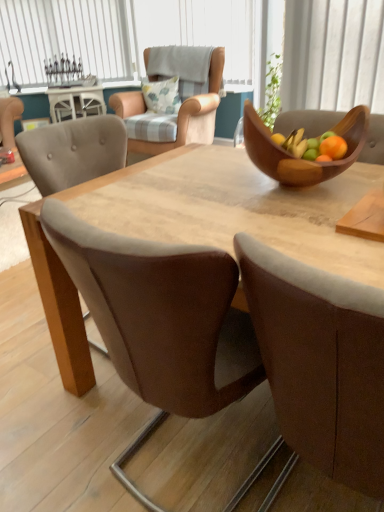
The height and width of the screenshot is (512, 384). Identify the location of light brown wooden table at center. (233, 208).

This screenshot has width=384, height=512. I want to click on white glossy cabinet at upper left, so click(x=75, y=102).

This screenshot has width=384, height=512. In order to click on light brown fabric armchair at upper center, which is the 2th chair in bottom-to-top order in this screenshot , I will do `click(192, 115)`.

What is the approximate width of light brown fabric armchair at upper center, which is the 2th chair in bottom-to-top order?

light brown fabric armchair at upper center, which is the 2th chair in bottom-to-top order, is 35.72 inches in width.

You are a GUI agent. You are given a task and a screenshot of the screen. Output one action in this format:
    pyautogui.click(x=<x>, y=<y>)
    Task: Click on the white vertical blinds at upper left
    
    Given the screenshot: What is the action you would take?
    pyautogui.click(x=66, y=37)

This screenshot has height=512, width=384. What do you see at coordinates (302, 159) in the screenshot? I see `wooden bowl at center` at bounding box center [302, 159].

Describe the element at coordinates (321, 362) in the screenshot. I see `brown leather chair at center, the second chair positioned from the back` at that location.

Where is `light brown wooden table at center`? The width and height of the screenshot is (384, 512). light brown wooden table at center is located at coordinates coord(233,208).

From the image's perspective, is white vertical blinds at upper left under white glossy cabinet at upper left?

Actually, white vertical blinds at upper left appears above white glossy cabinet at upper left in the image.

Is white vertical blinds at upper left facing away from white glossy cabinet at upper left?

No, white vertical blinds at upper left's orientation is not away from white glossy cabinet at upper left.

Does point (85, 46) come in front of point (63, 116)?

No.

In the scene shown: Is white vertical blinds at upper left in front of or behind white glossy cabinet at upper left in the image?

In the image, white vertical blinds at upper left appears behind white glossy cabinet at upper left.

Is light brown fabric armchair at upper center, which appears as the first chair when viewed from the top, looking in the opposite direction of white glossy cabinet at upper left?

No, white glossy cabinet at upper left is not at the back of light brown fabric armchair at upper center, which appears as the first chair when viewed from the top.

Based on the photo, from the image's perspective, is light brown fabric armchair at upper center, which appears as the first chair when viewed from the top, over white glossy cabinet at upper left?

No, from the image's perspective, light brown fabric armchair at upper center, which appears as the first chair when viewed from the top, is not over white glossy cabinet at upper left.

Considering the relative positions of light brown fabric armchair at upper center, which ranks as the 1th chair in back-to-front order, and white glossy cabinet at upper left in the image provided, is light brown fabric armchair at upper center, which ranks as the 1th chair in back-to-front order, to the left of white glossy cabinet at upper left from the viewer's perspective?

In fact, light brown fabric armchair at upper center, which ranks as the 1th chair in back-to-front order, is to the right of white glossy cabinet at upper left.

Where is `the 1st chair in front of the white glossy cabinet at upper left`? The image size is (384, 512). the 1st chair in front of the white glossy cabinet at upper left is located at coordinates (192, 115).

From the picture: Measure the distance between wooden bowl at center and white glossy cabinet at upper left.

They are 3.51 meters apart.

This screenshot has width=384, height=512. What are the coordinates of `coffee table that appears below the wooden bowl at center (from a real-world perspective)` in the screenshot? It's located at (75, 102).

Considering the points (250, 111) and (74, 93), which point is in front, point (250, 111) or point (74, 93)?

Point (250, 111)

Is wooden bowl at center outside of white glossy cabinet at upper left?

wooden bowl at center is positioned outside white glossy cabinet at upper left.

Is wooden bowl at center surrounding light brown fabric armchair at upper center, which appears as the first chair when viewed from the top?

No, light brown fabric armchair at upper center, which appears as the first chair when viewed from the top, is located outside of wooden bowl at center.

Could you tell me if wooden bowl at center is turned towards light brown fabric armchair at upper center, which ranks as the 1th chair in back-to-front order?

No, wooden bowl at center is not turned towards light brown fabric armchair at upper center, which ranks as the 1th chair in back-to-front order.

From a real-world perspective, is wooden bowl at center under light brown fabric armchair at upper center, which ranks as the 1th chair in back-to-front order?

No, from a real-world perspective, wooden bowl at center is not beneath light brown fabric armchair at upper center, which ranks as the 1th chair in back-to-front order.

The height and width of the screenshot is (512, 384). Find the location of `the 1st chair positioned below the wooden bowl at center (from a real-world perspective)`. the 1st chair positioned below the wooden bowl at center (from a real-world perspective) is located at coordinates (192, 115).

Does brown leather chair at center, the second chair positioned from the back, have a greater height compared to fluffy white pillow at upper center?

Yes.

From the image's perspective, which one is positioned lower, brown leather chair at center, the second chair positioned from the back, or fluffy white pillow at upper center?

brown leather chair at center, the second chair positioned from the back, is shown below in the image.

Considering the sizes of brown leather chair at center, which is the 2th chair from top to bottom, and fluffy white pillow at upper center in the image, is brown leather chair at center, which is the 2th chair from top to bottom, bigger or smaller than fluffy white pillow at upper center?

In the image, brown leather chair at center, which is the 2th chair from top to bottom, appears to be larger than fluffy white pillow at upper center.

From the image's perspective, between brown leather chair at center, which ranks as the 1th chair in bottom-to-top order, and light brown wooden table at center, who is located below?

brown leather chair at center, which ranks as the 1th chair in bottom-to-top order, appears lower in the image.

Is point (326, 464) farther from camera compared to point (346, 185)?

That is False.

Considering the sizes of brown leather chair at center, the second chair positioned from the back, and light brown wooden table at center in the image, is brown leather chair at center, the second chair positioned from the back, bigger or smaller than light brown wooden table at center?

brown leather chair at center, the second chair positioned from the back, is smaller than light brown wooden table at center.

Is brown leather chair at center, the second chair positioned from the back, positioned far away from light brown wooden table at center?

No, brown leather chair at center, the second chair positioned from the back, is not far from light brown wooden table at center.

Considering the relative sizes of light brown wooden table at center and light brown fabric armchair at upper center, which appears as the first chair when viewed from the top, in the image provided, is light brown wooden table at center thinner than light brown fabric armchair at upper center, which appears as the first chair when viewed from the top,?

Incorrect, the width of light brown wooden table at center is not less than that of light brown fabric armchair at upper center, which appears as the first chair when viewed from the top.

In the scene shown: Can you tell me how much light brown wooden table at center and light brown fabric armchair at upper center, which appears as the first chair when viewed from the top, differ in facing direction?

The angular difference between light brown wooden table at center and light brown fabric armchair at upper center, which appears as the first chair when viewed from the top, is 1.4 degrees.

From the picture: From the image's perspective, who appears lower, light brown wooden table at center or light brown fabric armchair at upper center, positioned as the 2th chair in front-to-back order?

From the image's view, light brown wooden table at center is below.

In terms of height, does light brown wooden table at center look taller or shorter compared to light brown fabric armchair at upper center, which is the 2th chair in bottom-to-top order?

light brown wooden table at center is shorter than light brown fabric armchair at upper center, which is the 2th chair in bottom-to-top order.

In the image, there is a white vertical blinds at upper left. At what (x,y) coordinates should I click in order to perform the action: click on coffee table below it (from the image's perspective). Please return your answer as a coordinate pair (x, y). This screenshot has width=384, height=512. Looking at the image, I should click on (75, 102).

From a real-world perspective, count 2nd chairs upward from the white glossy cabinet at upper left and point to it. Please provide its 2D coordinates.

[(192, 115)]

Looking at the image, which one is located closer to wooden bowl at center, brown leather chair at center, the second chair positioned from the back, or light brown fabric armchair at upper center, which appears as the first chair when viewed from the top?

brown leather chair at center, the second chair positioned from the back, lies closer to wooden bowl at center than the other object.

Considering their positions, is brown leather chair at center, which ranks as the 1th chair in bottom-to-top order, positioned closer to wooden bowl at center than white glossy cabinet at upper left?

brown leather chair at center, which ranks as the 1th chair in bottom-to-top order, lies closer to wooden bowl at center than the other object.

Considering their positions, is light brown fabric armchair at upper center, which is the 2th chair in bottom-to-top order, positioned further to light brown wooden table at center than fluffy white pillow at upper center?

fluffy white pillow at upper center is further to light brown wooden table at center.

Looking at the image, which one is located further to brown leather chair at center, which is the 2th chair from top to bottom, white vertical blinds at upper left or light brown wooden table at center?

white vertical blinds at upper left is further to brown leather chair at center, which is the 2th chair from top to bottom.

Based on their spatial positions, is white vertical blinds at upper left or brown leather chair at center, which appears as the first chair when viewed from the front, further from fluffy white pillow at upper center?

Based on the image, brown leather chair at center, which appears as the first chair when viewed from the front, appears to be further to fluffy white pillow at upper center.

Estimate the real-world distances between objects in this image. Which object is further from white glossy cabinet at upper left, wooden bowl at center or white vertical blinds at upper left?

The object further to white glossy cabinet at upper left is wooden bowl at center.

Looking at this image, based on their spatial positions, is white vertical blinds at upper left or wooden bowl at center closer to light brown fabric armchair at upper center, which ranks as the 1th chair in back-to-front order?

The object closer to light brown fabric armchair at upper center, which ranks as the 1th chair in back-to-front order, is white vertical blinds at upper left.

When comparing their distances from light brown wooden table at center, does white vertical blinds at upper left or light brown fabric armchair at upper center, which is the 2th chair in bottom-to-top order, seem closer?

Based on the image, light brown fabric armchair at upper center, which is the 2th chair in bottom-to-top order, appears to be nearer to light brown wooden table at center.

This screenshot has width=384, height=512. Find the location of `bowl between brown leather chair at center, the second chair positioned from the back, and white glossy cabinet at upper left, along the z-axis`. bowl between brown leather chair at center, the second chair positioned from the back, and white glossy cabinet at upper left, along the z-axis is located at coordinates (302, 159).

Find the location of a particular element. This screenshot has height=512, width=384. chair located between brown leather chair at center, the second chair positioned from the back, and white glossy cabinet at upper left in the depth direction is located at coordinates (192, 115).

Locate an element on the screen. The width and height of the screenshot is (384, 512). pillow positioned between wooden bowl at center and white glossy cabinet at upper left from near to far is located at coordinates (162, 95).

Locate an element on the screen. This screenshot has width=384, height=512. chair between light brown wooden table at center and white glossy cabinet at upper left along the z-axis is located at coordinates (192, 115).